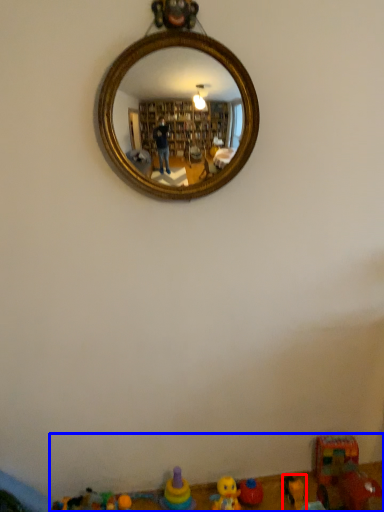
Question: Which object appears farthest to the camera in this image, toy (highlighted by a red box) or toy (highlighted by a blue box)?

Choices:
 (A) toy
 (B) toy

Answer: (A)